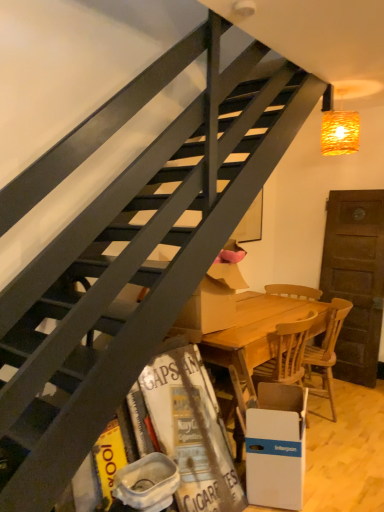
Question: In terms of width, does white plastic trash bin/can at lower center look wider or thinner when compared to white cardboard box at lower right?

Choices:
 (A) wide
 (B) thin

Answer: (B)

Question: From a real-world perspective, is white plastic trash bin/can at lower center positioned above or below white cardboard box at lower right?

Choices:
 (A) below
 (B) above

Answer: (B)

Question: Which object is the closest to the woven glass lampshade at upper right?

Choices:
 (A) wooden at under stairs, which is the first chair in left-to-right order
 (B) wooden at lower right, which appears as the 1th chair when viewed from the right
 (C) white cardboard box at lower right
 (D) white plastic trash bin/can at lower center

Answer: (B)

Question: Estimate the real-world distances between objects in this image. Which object is farther from the white cardboard box at lower right?

Choices:
 (A) wooden at lower right, which appears as the 1th chair when viewed from the right
 (B) wooden at under stairs, the 2th chair in the right-to-left sequence
 (C) white plastic trash bin/can at lower center
 (D) woven glass lampshade at upper right

Answer: (D)